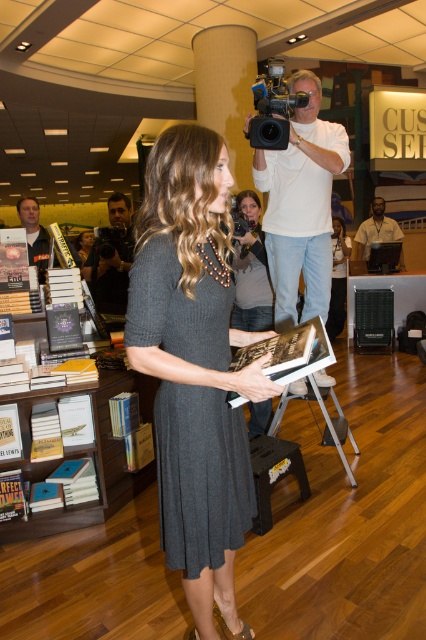
Question: Can you confirm if black matte dress at center is thinner than dark gray dress at center?

Choices:
 (A) no
 (B) yes

Answer: (B)

Question: Which point is farther to the camera?

Choices:
 (A) black matte dress at center
 (B) dark brown leather laptop at center
 (C) white matte camera at upper center
 (D) black plastic video camera at upper center

Answer: (A)

Question: Which of the following is the closest to the observer?

Choices:
 (A) black matte dress at center
 (B) white matte camera at upper center
 (C) dark gray wood bookshelf at center

Answer: (B)

Question: Which point is closer to the camera?

Choices:
 (A) (325, 324)
 (B) (17, 204)
 (C) (83, 257)
 (D) (319, 285)

Answer: (D)

Question: Does dark gray wood bookshelf at center appear on the left side of matte black book at left?

Choices:
 (A) no
 (B) yes

Answer: (A)

Question: Does white matte camera at upper center come in front of matte black book at left?

Choices:
 (A) no
 (B) yes

Answer: (B)